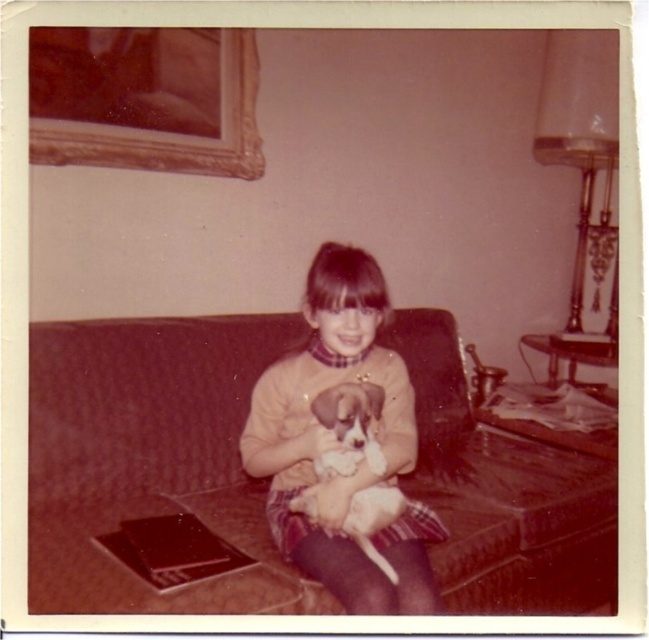
Does brown fabric couch at center appear over goldwooden frame at upper left?

Actually, brown fabric couch at center is below goldwooden frame at upper left.

Can you confirm if brown fabric couch at center is positioned to the right of goldwooden frame at upper left?

Yes, brown fabric couch at center is to the right of goldwooden frame at upper left.

Who is more forward, (563, 576) or (86, 45)?

Positioned in front is point (86, 45).

Find the location of a particular element. This screenshot has height=640, width=649. brown fabric couch at center is located at coordinates (151, 458).

Is brown fabric couch at center closer to the viewer compared to matte yellow sweater at center?

That is False.

Can you confirm if brown fabric couch at center is positioned above matte yellow sweater at center?

Actually, brown fabric couch at center is below matte yellow sweater at center.

Who is more forward, (530, 481) or (249, 461)?

Point (249, 461)

You are a GUI agent. You are given a task and a screenshot of the screen. Output one action in this format:
    pyautogui.click(x=<x>, y=<y>)
    Task: Click on the brown fabric couch at center
    
    Given the screenshot: What is the action you would take?
    pyautogui.click(x=151, y=458)

Can you confirm if goldwooden frame at upper left is positioned above white fur dog at center?

Yes.

Can you confirm if goldwooden frame at upper left is smaller than white fur dog at center?

Actually, goldwooden frame at upper left might be larger than white fur dog at center.

Image resolution: width=649 pixels, height=640 pixels. Describe the element at coordinates (145, 99) in the screenshot. I see `goldwooden frame at upper left` at that location.

Find the location of a particular element. This screenshot has height=640, width=649. goldwooden frame at upper left is located at coordinates (145, 99).